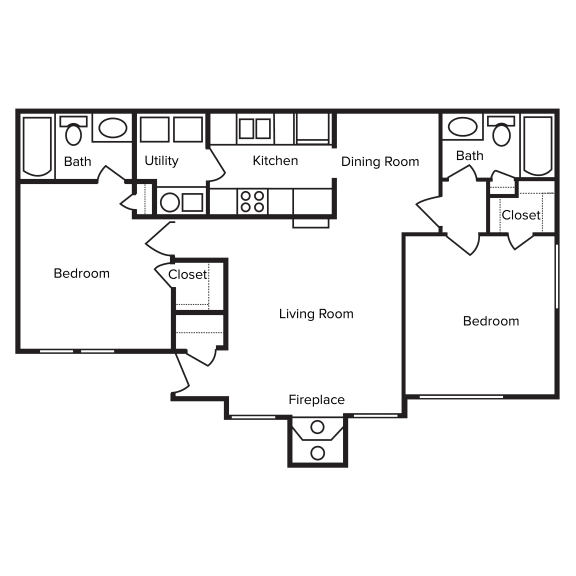
Locate an element on the screen. bedroom is located at coordinates (495, 291), (85, 285).